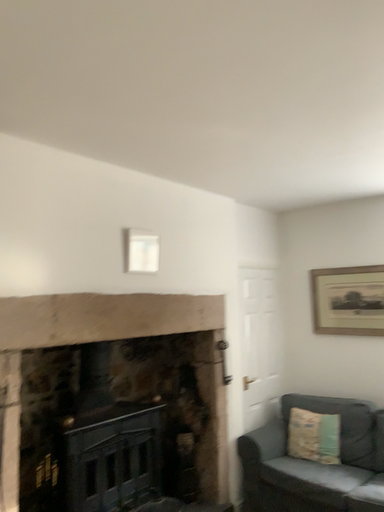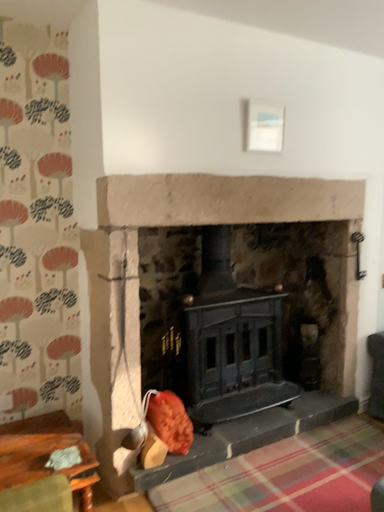
Question: Which way did the camera rotate in the video?

Choices:
 (A) rotated upward
 (B) rotated downward

Answer: (B)